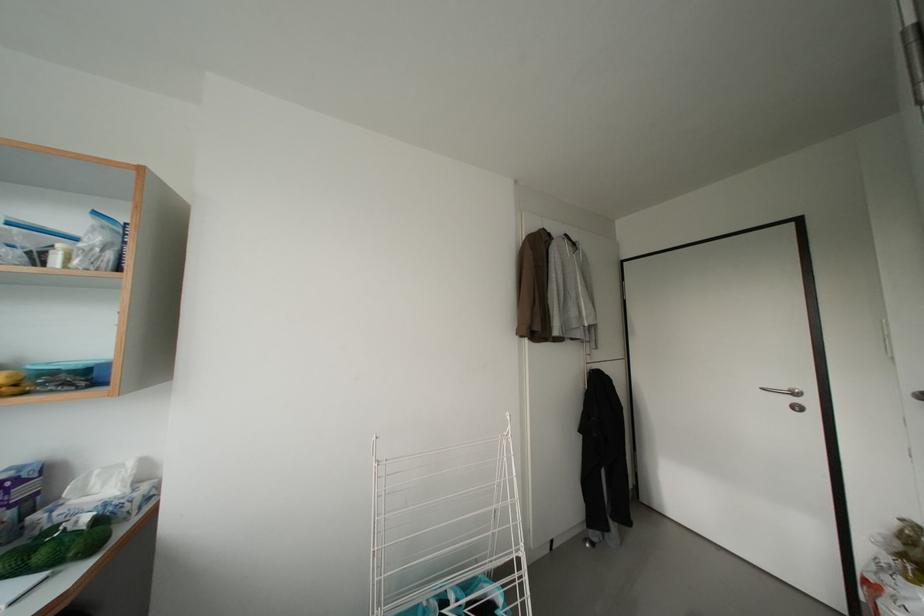
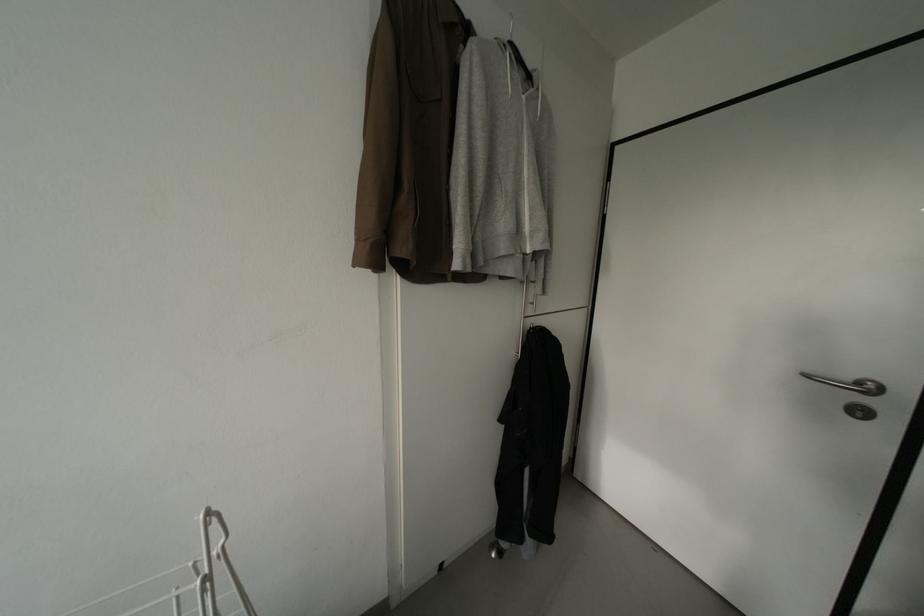
What movement of the cameraman would produce the second image?

The movement direction of the cameraman is right, forward.